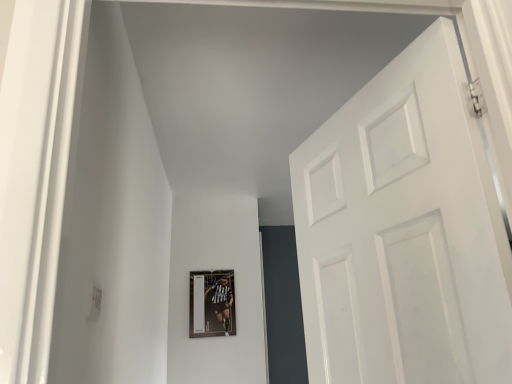
Find the location of `metallic silver picture frame at center`. metallic silver picture frame at center is located at coordinates (212, 303).

This screenshot has height=384, width=512. What do you see at coordinates (212, 303) in the screenshot?
I see `metallic silver picture frame at center` at bounding box center [212, 303].

Where is `metallic silver picture frame at center`? metallic silver picture frame at center is located at coordinates (212, 303).